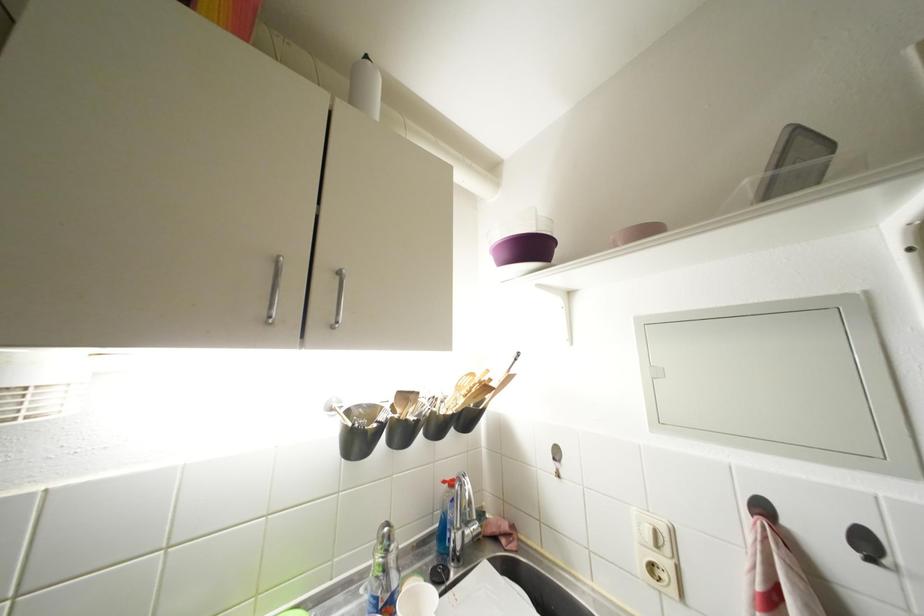
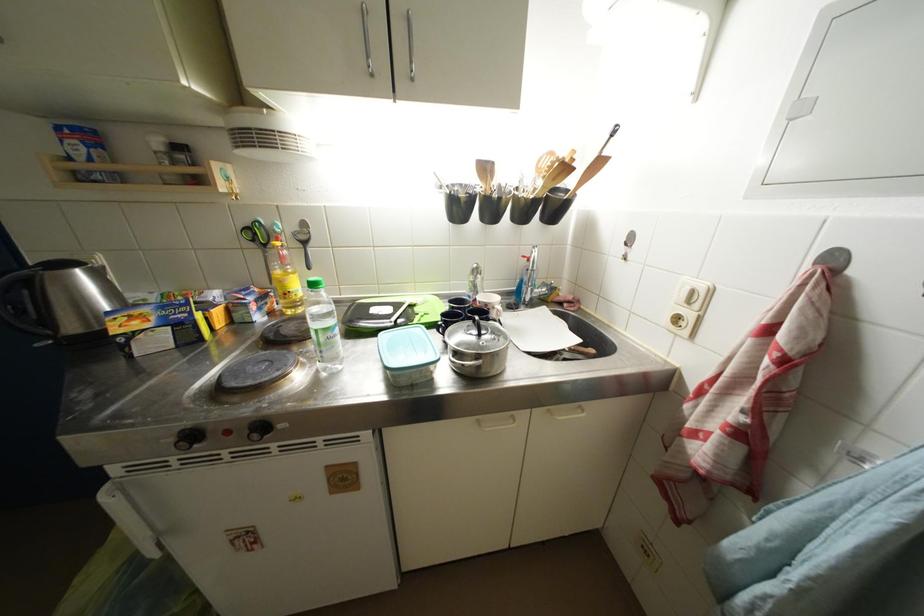
The point at (392, 573) is marked in the first image. Where is the corresponding point in the second image?

(481, 291)